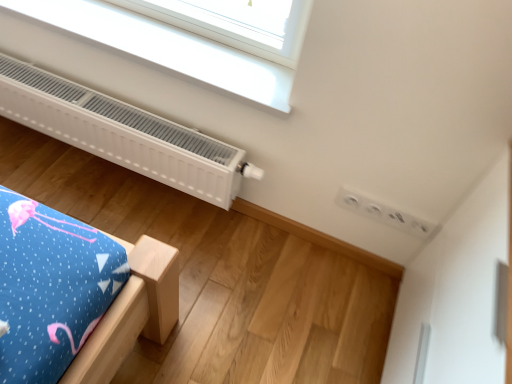
Question: From the image's perspective, is white plastic window at upper center below white matte radiator at upper left?

Choices:
 (A) no
 (B) yes

Answer: (A)

Question: Is white plastic window at upper center facing away from white matte radiator at upper left?

Choices:
 (A) no
 (B) yes

Answer: (A)

Question: Considering the relative positions of white plastic window at upper center and white matte radiator at upper left in the image provided, is white plastic window at upper center to the left of white matte radiator at upper left from the viewer's perspective?

Choices:
 (A) no
 (B) yes

Answer: (A)

Question: Can you confirm if white plastic window at upper center is bigger than white matte radiator at upper left?

Choices:
 (A) yes
 (B) no

Answer: (B)

Question: Is white plastic window at upper center not inside white matte radiator at upper left?

Choices:
 (A) no
 (B) yes

Answer: (B)

Question: From a real-world perspective, is white plastic window at upper center physically above white matte radiator at upper left?

Choices:
 (A) no
 (B) yes

Answer: (B)

Question: Is white matte radiator at upper left to the left of white plastic window at upper center from the viewer's perspective?

Choices:
 (A) yes
 (B) no

Answer: (A)

Question: Considering the relative sizes of white matte radiator at upper left and white plastic window at upper center in the image provided, is white matte radiator at upper left bigger than white plastic window at upper center?

Choices:
 (A) yes
 (B) no

Answer: (A)

Question: From the image's perspective, is white matte radiator at upper left located beneath white plastic window at upper center?

Choices:
 (A) no
 (B) yes

Answer: (B)

Question: Is white matte radiator at upper left next to white plastic window at upper center?

Choices:
 (A) no
 (B) yes

Answer: (A)

Question: Considering the relative sizes of white matte radiator at upper left and white plastic window at upper center in the image provided, is white matte radiator at upper left thinner than white plastic window at upper center?

Choices:
 (A) no
 (B) yes

Answer: (B)

Question: Is white matte radiator at upper left oriented towards white plastic window at upper center?

Choices:
 (A) yes
 (B) no

Answer: (B)

Question: Is white matte radiator at upper left wider or thinner than white plastic window at upper center?

Choices:
 (A) wide
 (B) thin

Answer: (B)